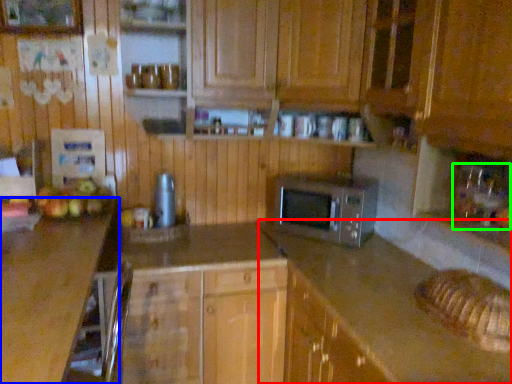
Question: Which object is positioned closest to counter (highlighted by a red box)? Select from countertop (highlighted by a blue box) and sink (highlighted by a green box).

Choices:
 (A) countertop
 (B) sink

Answer: (B)